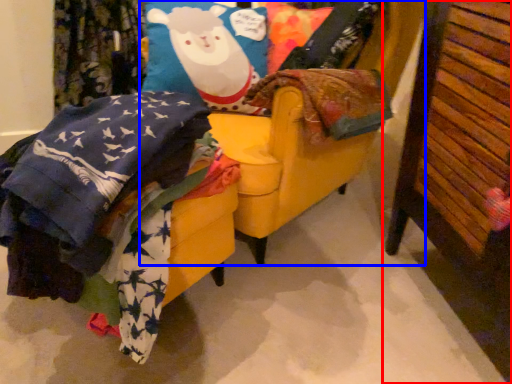
Question: Which object is closer to the camera taking this photo, furniture (highlighted by a red box) or swivel chair (highlighted by a blue box)?

Choices:
 (A) furniture
 (B) swivel chair

Answer: (A)